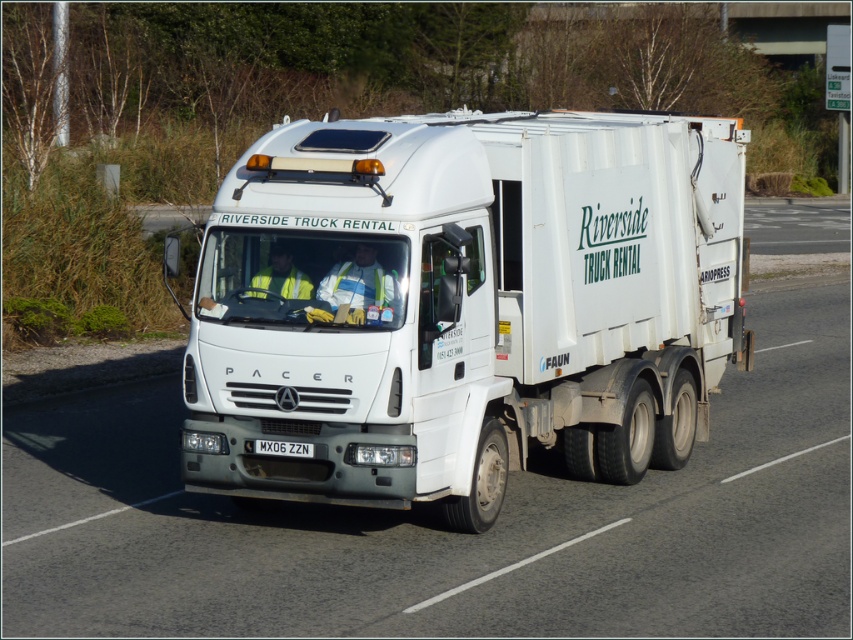
Question: Which of the following is the farthest from the observer?

Choices:
 (A) (679, 424)
 (B) (299, 445)

Answer: (A)

Question: Which point is farther to the camera?

Choices:
 (A) (258, 445)
 (B) (383, 172)

Answer: (A)

Question: Can you confirm if white matte trailer truck at center is bigger than white metallic license plate at center?

Choices:
 (A) no
 (B) yes

Answer: (B)

Question: Is white matte trailer truck at center wider than white metallic license plate at center?

Choices:
 (A) no
 (B) yes

Answer: (B)

Question: Considering the relative positions of white matte trailer truck at center and white metallic license plate at center in the image provided, where is white matte trailer truck at center located with respect to white metallic license plate at center?

Choices:
 (A) left
 (B) right

Answer: (B)